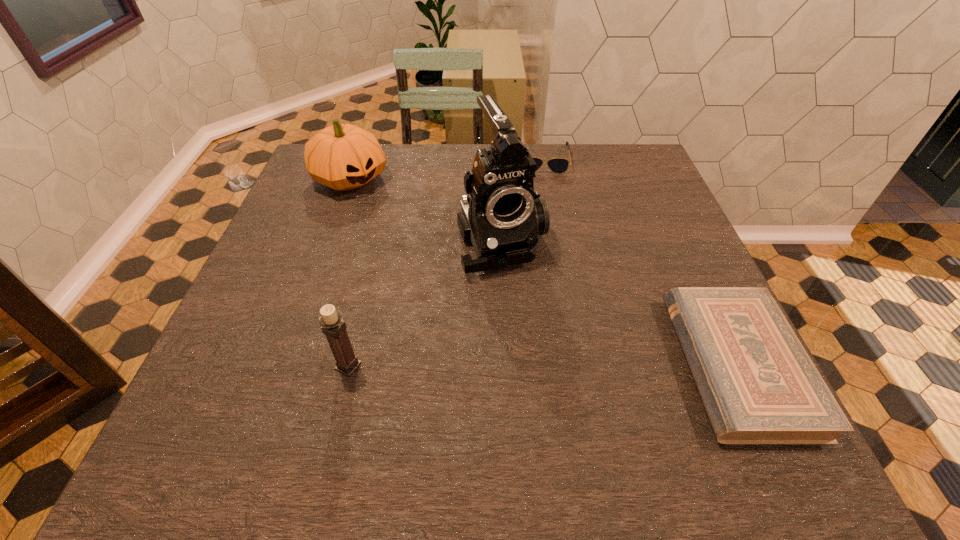
Find the location of `free space located on the lens mount of the tallest object`. free space located on the lens mount of the tallest object is located at coordinates (562, 375).

This screenshot has width=960, height=540. What are the coordinates of `free spot located 0.130m on the lens mount of the tallest object` in the screenshot? It's located at (538, 325).

Identify the location of vacant space located 0.180m on the lens mount of the tallest object. The height and width of the screenshot is (540, 960). (547, 345).

Identify the location of free location located on the side of the gourd with the carved face. (410, 231).

At what (x,y) coordinates should I click in order to perform the action: click on vacant space located 0.340m on the side of the gourd with the carved face. Please return your answer as a coordinate pair (x, y). Looking at the image, I should click on (445, 263).

Identify the location of vacant area situated on the side of the gourd with the carved face. This screenshot has height=540, width=960. (441, 259).

I want to click on vacant space located 0.230m on the front-facing side of the sunglasses, so click(x=547, y=225).

The image size is (960, 540). I want to click on free region located 0.270m on the front-facing side of the sunglasses, so click(548, 235).

In order to click on vacant point located on the front-facing side of the sunglasses in this screenshot , I will do `click(547, 220)`.

What are the coordinates of `gourd located in the far edge section of the desktop` in the screenshot? It's located at (343, 157).